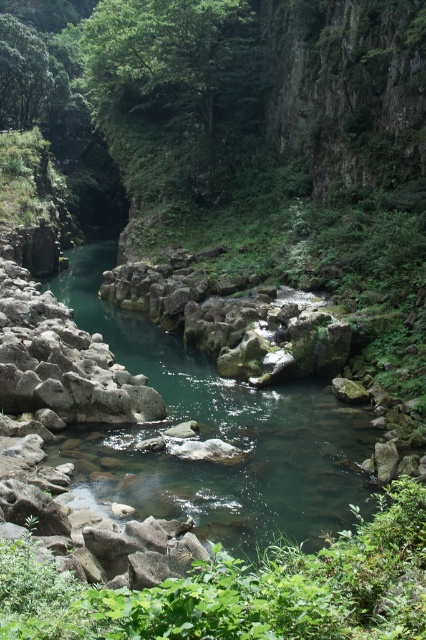
How much distance is there between green smooth water at center and green leafy shrubs at center?

green smooth water at center and green leafy shrubs at center are 18.24 meters apart from each other.

Who is shorter, green smooth water at center or green leafy shrubs at center?

Standing shorter between the two is green leafy shrubs at center.

Image resolution: width=426 pixels, height=640 pixels. Find the location of `green smooth water at center`. green smooth water at center is located at coordinates (218, 435).